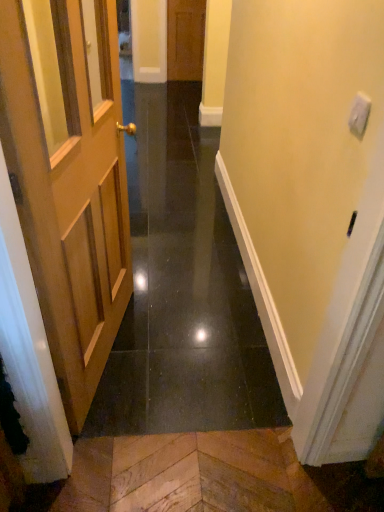
The image size is (384, 512). I want to click on unoccupied space behind light brown wooden door at left, the second door from the top, so click(173, 280).